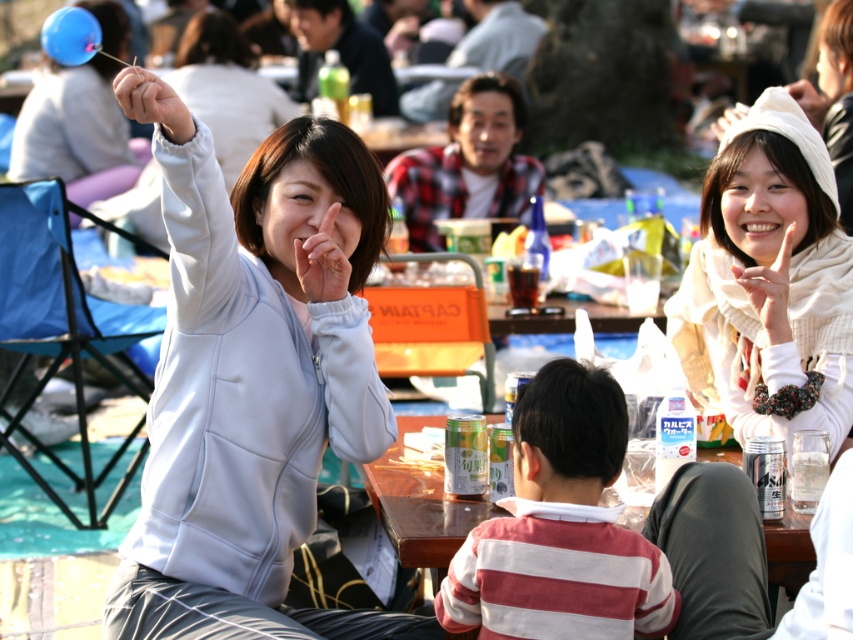
You are a photographer trying to capture a candid shot of both the light blue fabric jacket at center and the striped cotton shirt at center. Since you want to ensure both are in focus, which one should you focus on first to account for their depth positions?

You should focus on the light blue fabric jacket at center first because it is closer to you than the striped cotton shirt at center, so adjusting focus from near to far will help both be in focus.

You are standing at the picnic area and see the point marked as point (389, 422). If you want to place a 2 meter long picnic blanket there, will it fit without overlapping other objects?

The point (389, 422) is 5.50 meters from viewer. Since the distance is greater than the length of the picnic blanket, it can be placed there without overlapping other objects.

You are a photographer at the picnic and want to capture a photo of the light blue fabric jacket at center and the wooden table at center. Which object should you focus on first if you want to include both in your shot without moving the camera?

The light blue fabric jacket at center is much taller than the wooden table at center, so you should focus on the light blue fabric jacket at center first to ensure it fits within the frame.